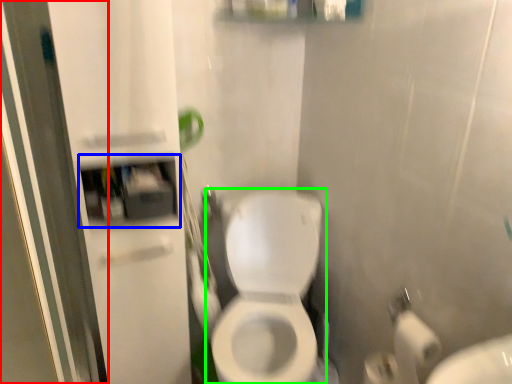
Question: Which object is the closest to the screen door (highlighted by a red box)? Choose among these: medicine cabinet (highlighted by a blue box) or toilet (highlighted by a green box).

Choices:
 (A) medicine cabinet
 (B) toilet

Answer: (A)